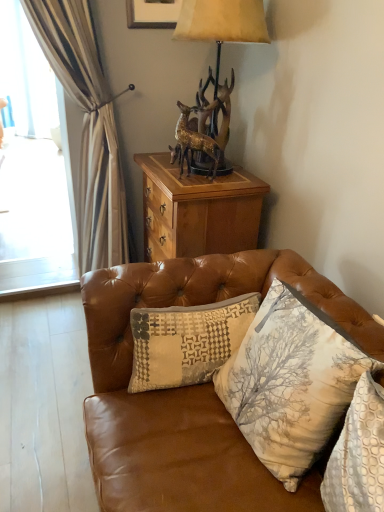
Question: Is textured beige pillow at center, which ranks as the 1th pillow in left-to-right order, bigger or smaller than wooden cabinet at upper center?

Choices:
 (A) small
 (B) big

Answer: (A)

Question: Is textured beige pillow at center, which is the 3th pillow from right to left, situated inside wooden cabinet at upper center or outside?

Choices:
 (A) inside
 (B) outside

Answer: (B)

Question: Estimate the real-world distances between objects in this image. Which object is farther from the gold metallic lamp at upper center?

Choices:
 (A) printed fabric cushion at lower right, positioned as the 1th pillow in right-to-left order
 (B) leather couch at center
 (C) beige textured pillow at center, placed as the 2th pillow when sorted from left to right
 (D) gold metallic deer at center
 (E) matte gray picture frame at upper center

Answer: (A)

Question: Which object is positioned farthest from the wooden cabinet at upper center?

Choices:
 (A) matte gray picture frame at upper center
 (B) textured beige pillow at center, which is the 3th pillow from right to left
 (C) leather couch at center
 (D) gold metallic deer at center
 (E) beige textured pillow at center, placed as the 2th pillow when sorted from left to right

Answer: (A)